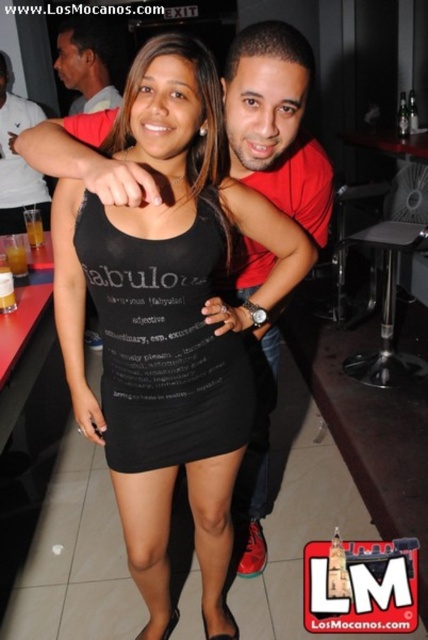
Is point (139, 99) farther from viewer compared to point (82, 106)?

No, it is not.

Who is more forward, (202, 496) or (59, 58)?

Positioned in front is point (202, 496).

Does point (131, 273) come behind point (68, 72)?

No, (131, 273) is in front of (68, 72).

Where is `black fabric dress at center`? The height and width of the screenshot is (640, 428). black fabric dress at center is located at coordinates (169, 321).

You are a GUI agent. You are given a task and a screenshot of the screen. Output one action in this format:
    pyautogui.click(x=<x>, y=<y>)
    Task: Click on the white matte t-shirt at upper center
    The height and width of the screenshot is (640, 428).
    Given the screenshot: What is the action you would take?
    pyautogui.click(x=17, y=161)

Is white matte t-shirt at upper center bigger than matte black shirt at upper left?

No, white matte t-shirt at upper center is not bigger than matte black shirt at upper left.

In order to click on white matte t-shirt at upper center in this screenshot , I will do `click(17, 161)`.

I want to click on white matte t-shirt at upper center, so click(x=17, y=161).

Who is positioned more to the right, black fabric dress at center or black matte tank top at center?

Positioned to the right is black fabric dress at center.

Does black fabric dress at center have a smaller size compared to black matte tank top at center?

Actually, black fabric dress at center might be larger than black matte tank top at center.

Is point (211, 529) positioned after point (178, 419)?

Yes, it is.

At what (x,y) coordinates should I click in order to perform the action: click on black fabric dress at center. Please return your answer as a coordinate pair (x, y). The width and height of the screenshot is (428, 640). Looking at the image, I should click on (169, 321).